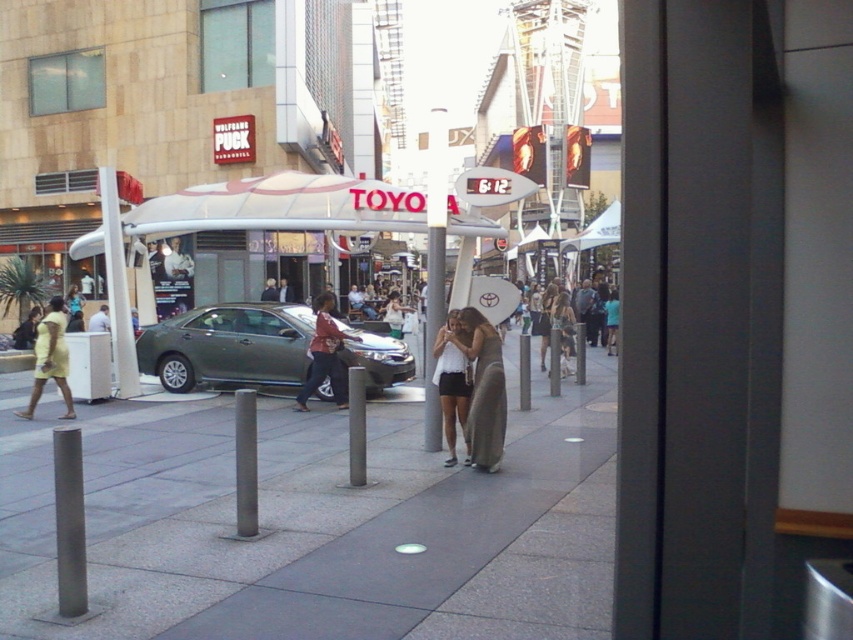
Is white glossy pole at center further to camera compared to smooth gray pole at center?

No, it is in front of smooth gray pole at center.

Between white glossy pole at center and smooth gray pole at center, which one is positioned lower?

smooth gray pole at center is below.

Is point (425, 339) positioned behind point (552, 376)?

No, it is not.

The image size is (853, 640). Find the location of `white glossy pole at center`. white glossy pole at center is located at coordinates (434, 268).

Based on the photo, can you confirm if satin silver pole at center is positioned to the left of dark red fabric jacket at center?

No, satin silver pole at center is not to the left of dark red fabric jacket at center.

Can you confirm if satin silver pole at center is taller than dark red fabric jacket at center?

No, satin silver pole at center is not taller than dark red fabric jacket at center.

The height and width of the screenshot is (640, 853). Find the location of `satin silver pole at center`. satin silver pole at center is located at coordinates (245, 461).

Where is `white plastic pole at center`? The width and height of the screenshot is (853, 640). white plastic pole at center is located at coordinates (117, 288).

Is point (109, 241) positioned before point (572, 337)?

Yes, point (109, 241) is in front of point (572, 337).

Locate an element on the screen. The height and width of the screenshot is (640, 853). white plastic pole at center is located at coordinates (117, 288).